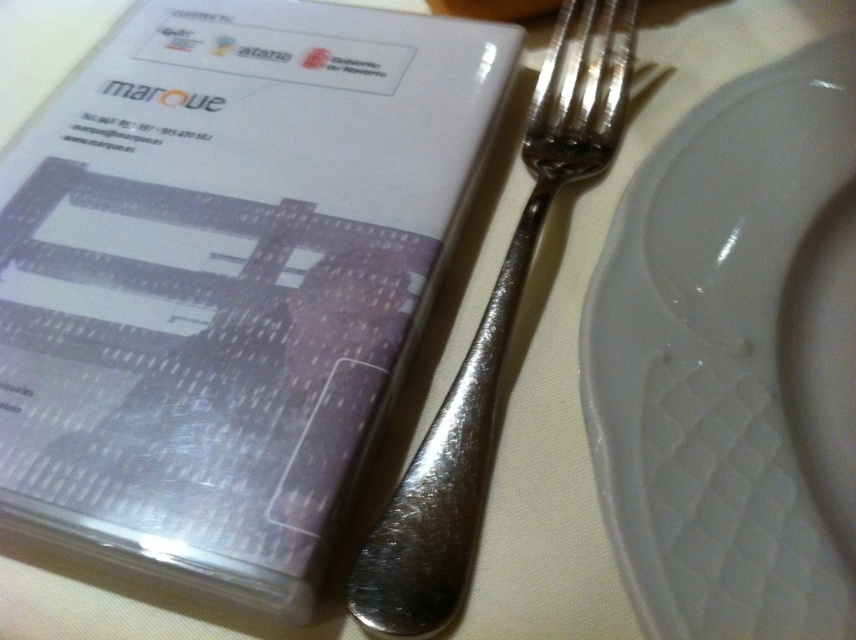
Question: Is white glossy platter at center wider than polished silver fork at center?

Choices:
 (A) no
 (B) yes

Answer: (B)

Question: Which object is farther from the camera taking this photo?

Choices:
 (A) white glossy platter at center
 (B) polished silver fork at center

Answer: (B)

Question: Is white glossy platter at center below polished silver fork at center?

Choices:
 (A) no
 (B) yes

Answer: (B)

Question: Can you confirm if white glossy platter at center is thinner than polished silver fork at center?

Choices:
 (A) yes
 (B) no

Answer: (B)